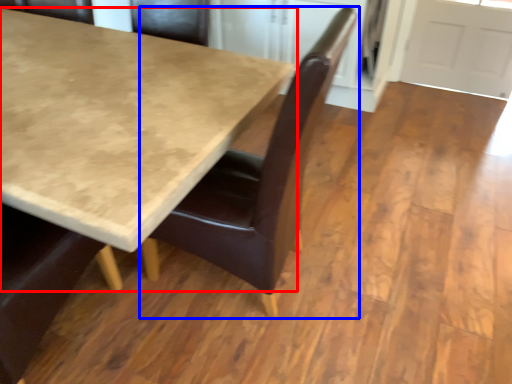
Question: Which of the following is the farthest to the observer, table (highlighted by a red box) or chair (highlighted by a blue box)?

Choices:
 (A) table
 (B) chair

Answer: (B)